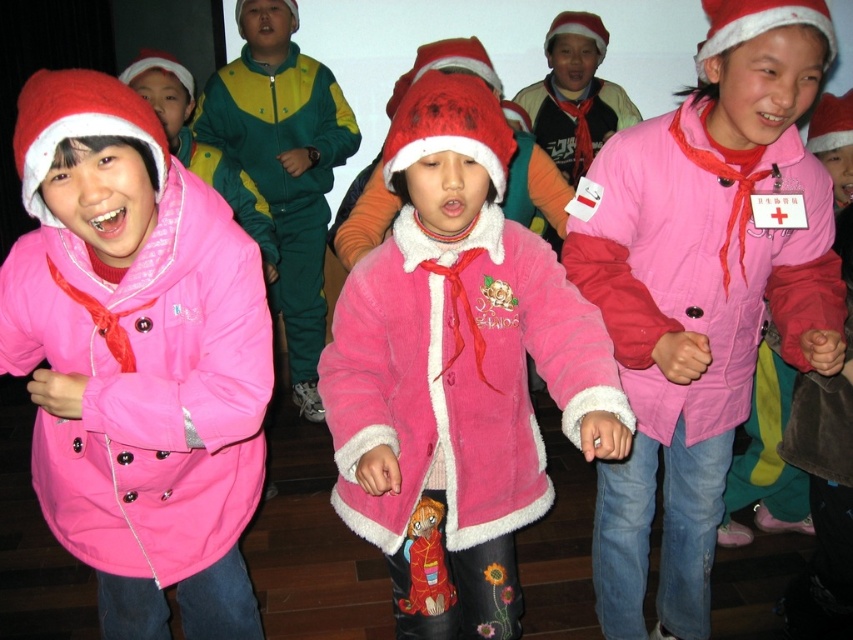
Is pink fleece jacket at center in front of green/yellow fabric jacket at center?

Yes.

Is pink fleece jacket at center positioned behind green/yellow fabric jacket at center?

No, it is not.

Where is `pink fleece jacket at center`? The height and width of the screenshot is (640, 853). pink fleece jacket at center is located at coordinates (698, 266).

Who is shorter, fuzzy pink coat at center or green/yellow fabric jacket at center?

Standing shorter between the two is fuzzy pink coat at center.

Who is more distant from viewer, (409, 493) or (296, 180)?

Positioned behind is point (296, 180).

Describe the element at coordinates (457, 376) in the screenshot. This screenshot has height=640, width=853. I see `fuzzy pink coat at center` at that location.

Where is `fuzzy pink coat at center`? The image size is (853, 640). fuzzy pink coat at center is located at coordinates (457, 376).

Between fuzzy pink coat at center and pink fleece jacket at center, which one has more height?

pink fleece jacket at center

Between fuzzy pink coat at center and pink fleece jacket at center, which one is positioned lower?

Positioned lower is fuzzy pink coat at center.

Is point (625, 420) behind point (808, 218)?

No, it is in front of (808, 218).

The width and height of the screenshot is (853, 640). What are the coordinates of `fuzzy pink coat at center` in the screenshot? It's located at (457, 376).